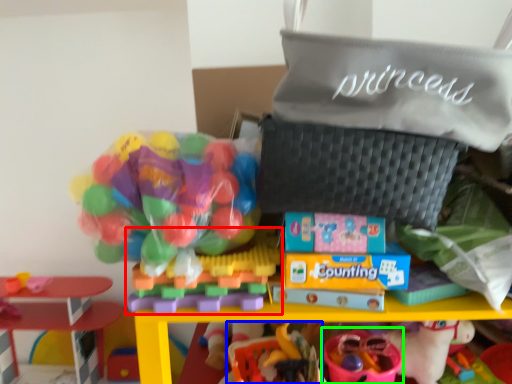
Question: Estimate the real-world distances between objects in this image. Which object is closer to toy (highlighted by a red box), toy (highlighted by a blue box) or toy (highlighted by a green box)?

Choices:
 (A) toy
 (B) toy

Answer: (A)